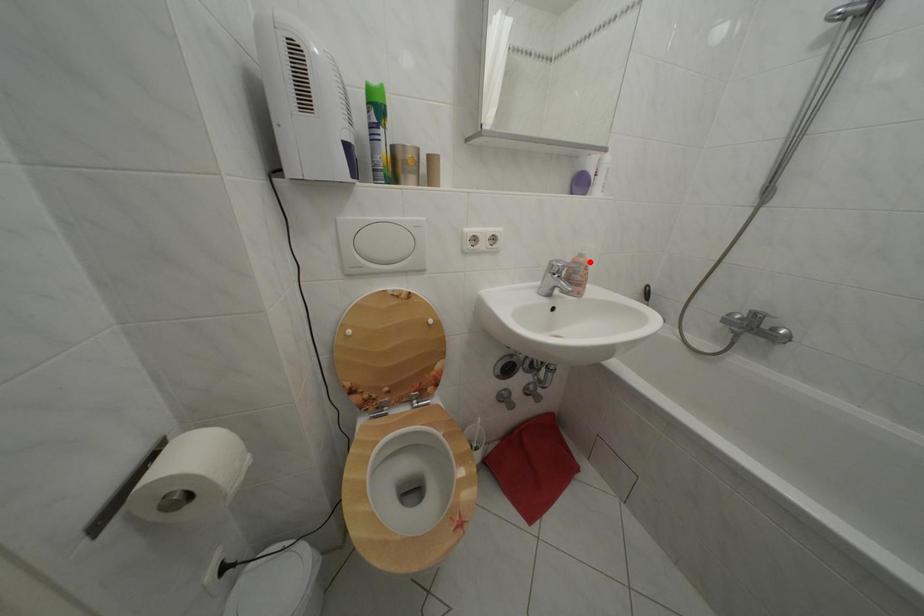
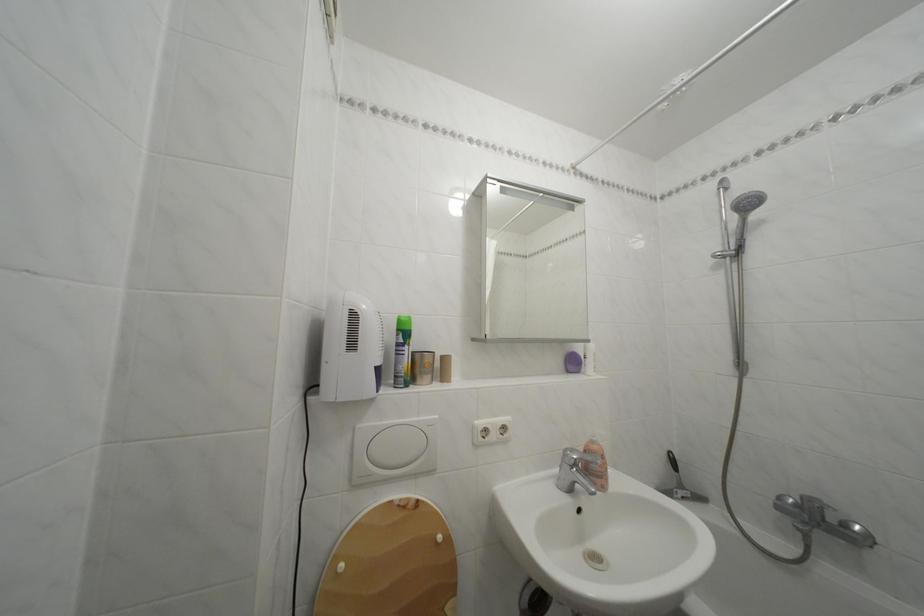
Locate, in the second image, the point that corresponds to the highlighted location in the first image.

(602, 448)